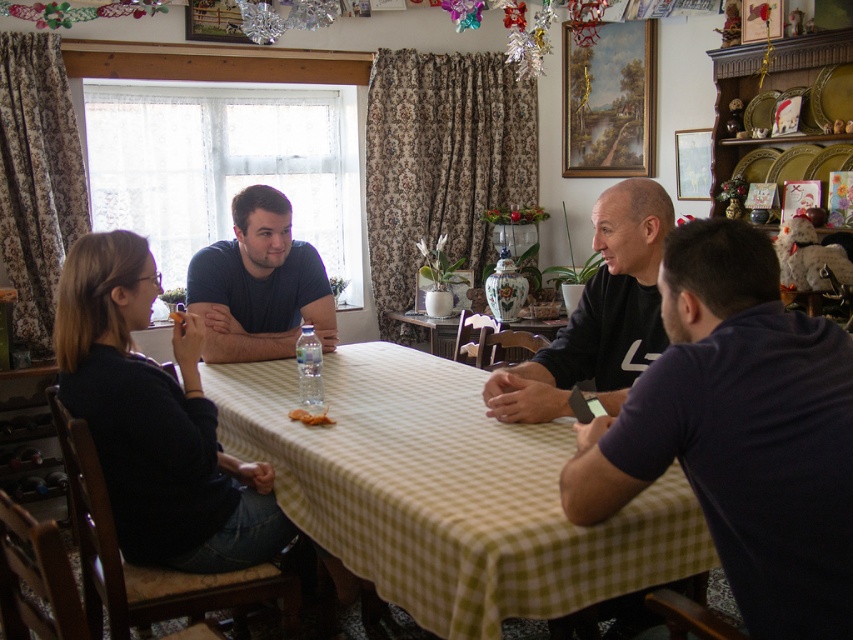
Question: Considering the real-world distances, which object is farthest from the green checkered tablecloth at center?

Choices:
 (A) dark blue t-shirt at right
 (B) yellow cracker at table center

Answer: (A)

Question: Is yellow checkered tablecloth at center below dark blue t-shirt at right?

Choices:
 (A) no
 (B) yes

Answer: (B)

Question: Does matte blue shirt at center appear over yellow cracker at table center?

Choices:
 (A) no
 (B) yes

Answer: (B)

Question: Can you confirm if dark blue t-shirt at right is positioned below green checkered tablecloth at center?

Choices:
 (A) yes
 (B) no

Answer: (A)

Question: Which point is closer to the camera taking this photo?

Choices:
 (A) (288, 205)
 (B) (289, 416)
 (C) (383, 556)

Answer: (C)

Question: Which of the following is the closest to the observer?

Choices:
 (A) (505, 550)
 (B) (776, 353)
 (C) (436, 342)

Answer: (B)